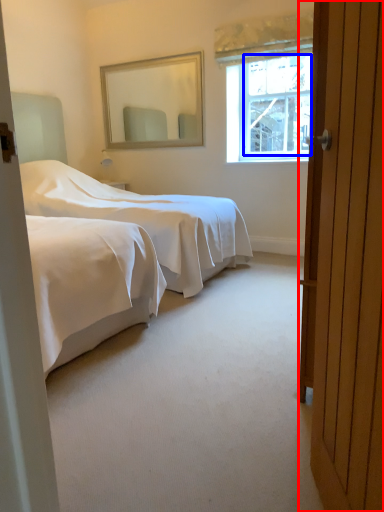
Question: Which object appears closest to the camera in this image, door (highlighted by a red box) or window screen (highlighted by a blue box)?

Choices:
 (A) door
 (B) window screen

Answer: (A)